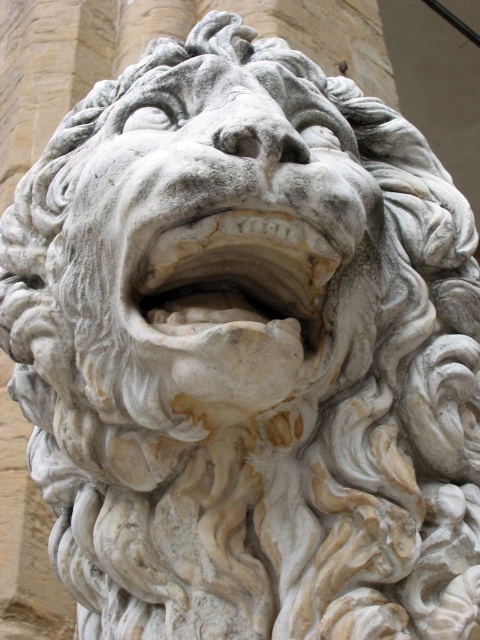
You are an architect designing a new building and want to place a statue exactly at point (x=204, y=234). Based on the image, which object should you place there?

You should place the white stone lion head at center at point (x=204, y=234) because it is already located there in the image.

You are an architect designing a new building and want to place a statue of a lion head next to a door. The door is 36 inches wide. Can the white stone lion head at center and the white stone mouth at center fit side by side next to the door without overlapping?

The white stone lion head at center is 35.57 inches from the white stone mouth at center, meaning they can be placed side by side next to the 36 inch wide door without overlapping since the combined width would be 35.57 inches, which is less than 36 inches.

You are an art restorer working on the white stone lion head at center and the white stone mouth at center. You need to apply a protective coating. Which object requires a larger amount of coating material based on their size?

The white stone lion head at center requires a larger amount of coating material because it is larger in size than the white stone mouth at center.